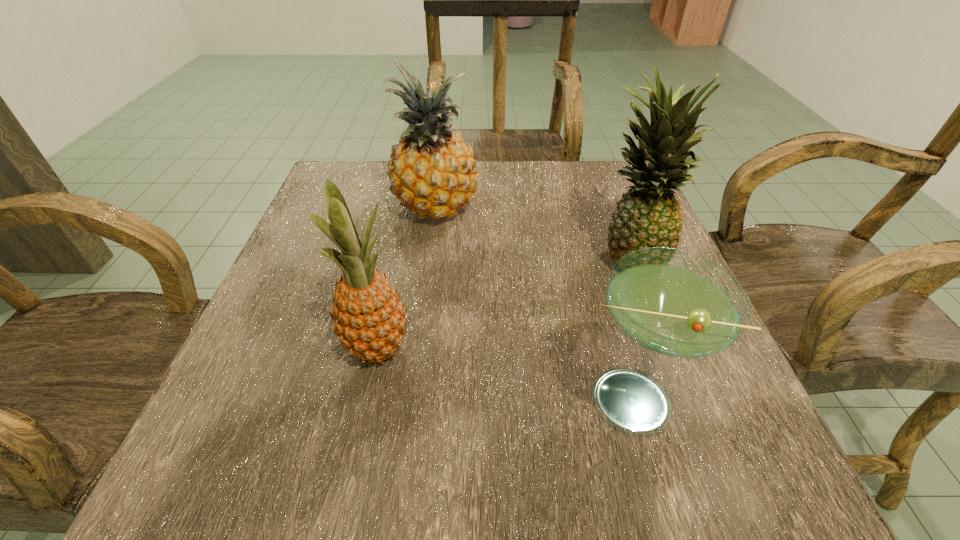
Find the location of `object that is the second closest to the rightmost pineapple`. object that is the second closest to the rightmost pineapple is located at coordinates (432, 171).

Locate which object ranks in proximity to the nearest pineapple. Please provide its 2D coordinates. Your answer should be formatted as a tuple, i.e. [(x, y)], where the tuple contains the x and y coordinates of a point satisfying the conditions above.

[(432, 171)]

Choose which pineapple is the second nearest neighbor to the nearest pineapple. Please provide its 2D coordinates. Your answer should be formatted as a tuple, i.e. [(x, y)], where the tuple contains the x and y coordinates of a point satisfying the conditions above.

[(648, 215)]

Identify the location of pineapple that is the second closest to the rightmost pineapple. (369, 318).